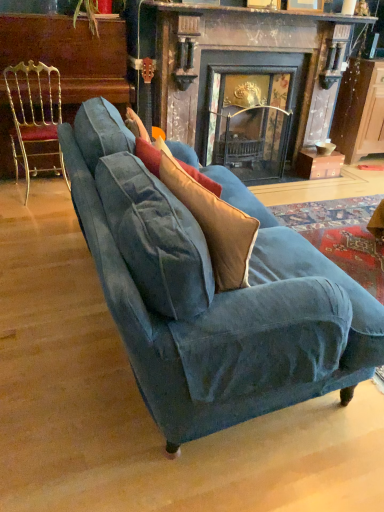
The image size is (384, 512). Identify the location of gold metallic chair at left. (35, 115).

This screenshot has height=512, width=384. What do you see at coordinates (360, 111) in the screenshot?
I see `wooden cabinet at right` at bounding box center [360, 111].

The image size is (384, 512). What do you see at coordinates (214, 224) in the screenshot?
I see `velvet beige throw pillow at center` at bounding box center [214, 224].

The image size is (384, 512). In order to click on gold metallic chair at left in this screenshot , I will do `click(35, 115)`.

Is point (222, 263) less distant than point (316, 126)?

Yes, it is.

Identify the location of fireplace behind the velvet beige throw pillow at center. The height and width of the screenshot is (512, 384). (246, 82).

From the image's perspective, is velvet beige throw pillow at center located beneath dark wood fireplace at center?

Correct, velvet beige throw pillow at center appears lower than dark wood fireplace at center in the image.

Could you tell me if velvet beige throw pillow at center is turned towards dark wood fireplace at center?

No, velvet beige throw pillow at center is not facing towards dark wood fireplace at center.

Between dark wood fireplace at center and wooden cabinet at right, which one has smaller width?

With smaller width is wooden cabinet at right.

How many degrees apart are the facing directions of dark wood fireplace at center and wooden cabinet at right?

The angle between the facing direction of dark wood fireplace at center and the facing direction of wooden cabinet at right is 1.42 degrees.

From the image's perspective, is dark wood fireplace at center beneath wooden cabinet at right?

Yes, from the image's perspective, dark wood fireplace at center is beneath wooden cabinet at right.

From a real-world perspective, is dark wood fireplace at center on top of wooden cabinet at right?

Yes, from a real-world perspective, dark wood fireplace at center is above wooden cabinet at right.

Which of these two, velvet beige throw pillow at center or wooden cabinet at right, is bigger?

Bigger between the two is wooden cabinet at right.

Considering the relative sizes of velvet beige throw pillow at center and wooden cabinet at right in the image provided, is velvet beige throw pillow at center thinner than wooden cabinet at right?

Indeed, velvet beige throw pillow at center has a lesser width compared to wooden cabinet at right.

Considering their positions, is velvet beige throw pillow at center located in front of or behind wooden cabinet at right?

Visually, velvet beige throw pillow at center is located in front of wooden cabinet at right.

I want to click on studio couch below the velvet beige throw pillow at center (from the image's perspective), so click(x=211, y=294).

Is velvet beige throw pillow at center thinner than velvet blue couch at center?

Yes.

Based on their positions, is velvet beige throw pillow at center located to the left or right of velvet blue couch at center?

From the image, it's evident that velvet beige throw pillow at center is to the left of velvet blue couch at center.

From the image's perspective, which is above, velvet beige throw pillow at center or velvet blue couch at center?

velvet beige throw pillow at center appears higher in the image.

Is point (320, 382) in front of point (367, 111)?

That is True.

Would you say velvet blue couch at center is outside wooden cabinet at right?

Yes.

Looking at this image, considering the sizes of velvet blue couch at center and wooden cabinet at right in the image, is velvet blue couch at center wider or thinner than wooden cabinet at right?

Clearly, velvet blue couch at center has more width compared to wooden cabinet at right.

How far apart are wooden cabinet at right and gold metallic chair at left?

wooden cabinet at right and gold metallic chair at left are 8.74 feet apart.

Which of these two, wooden cabinet at right or gold metallic chair at left, stands taller?

wooden cabinet at right is taller.

From the image's perspective, is wooden cabinet at right under gold metallic chair at left?

Actually, wooden cabinet at right appears above gold metallic chair at left in the image.

Is wooden cabinet at right oriented away from gold metallic chair at left?

wooden cabinet at right does not have its back to gold metallic chair at left.

Considering the points (17, 71) and (256, 145), which point is behind, point (17, 71) or point (256, 145)?

The point (256, 145) is farther.

Is gold metallic chair at left to the right of dark wood fireplace at center from the viewer's perspective?

Incorrect, gold metallic chair at left is not on the right side of dark wood fireplace at center.

Can you confirm if gold metallic chair at left is taller than dark wood fireplace at center?

No, gold metallic chair at left is not taller than dark wood fireplace at center.

Considering the sizes of objects gold metallic chair at left and dark wood fireplace at center in the image provided, who is thinner, gold metallic chair at left or dark wood fireplace at center?

gold metallic chair at left is thinner.

The image size is (384, 512). In order to click on throw pillow below the dark wood fireplace at center (from the image's perspective) in this screenshot , I will do `click(214, 224)`.

In the image, there is a dark wood fireplace at center. Where is `cabinetry below it (from a real-world perspective)`? cabinetry below it (from a real-world perspective) is located at coordinates pyautogui.click(x=360, y=111).

Based on their spatial positions, is velvet beige throw pillow at center or velvet blue couch at center further from wooden cabinet at right?

velvet beige throw pillow at center is positioned further to the anchor wooden cabinet at right.

Consider the image. Looking at the image, which one is located further to velvet beige throw pillow at center, gold metallic chair at left or dark wood fireplace at center?

Among the two, dark wood fireplace at center is located further to velvet beige throw pillow at center.

Based on their spatial positions, is wooden cabinet at right or velvet beige throw pillow at center closer to velvet blue couch at center?

The object closer to velvet blue couch at center is velvet beige throw pillow at center.

When comparing their distances from dark wood fireplace at center, does velvet blue couch at center or velvet beige throw pillow at center seem closer?

velvet blue couch at center.

Considering their positions, is velvet beige throw pillow at center positioned further to gold metallic chair at left than wooden cabinet at right?

The object further to gold metallic chair at left is wooden cabinet at right.

From the image, which object appears to be farther from gold metallic chair at left, wooden cabinet at right or velvet blue couch at center?

wooden cabinet at right lies further to gold metallic chair at left than the other object.

Based on their spatial positions, is dark wood fireplace at center or gold metallic chair at left closer to wooden cabinet at right?

The object closer to wooden cabinet at right is dark wood fireplace at center.

From the image, which object appears to be farther from wooden cabinet at right, gold metallic chair at left or velvet blue couch at center?

The object further to wooden cabinet at right is velvet blue couch at center.

What are the coordinates of `fireplace between gold metallic chair at left and wooden cabinet at right from left to right` in the screenshot? It's located at (246, 82).

Find the location of a particular element. throw pillow located between gold metallic chair at left and wooden cabinet at right in the left-right direction is located at coordinates (214, 224).

The image size is (384, 512). I want to click on throw pillow between gold metallic chair at left and dark wood fireplace at center, so click(214, 224).

Locate an element on the screen. fireplace located between velvet blue couch at center and wooden cabinet at right in the depth direction is located at coordinates (246, 82).